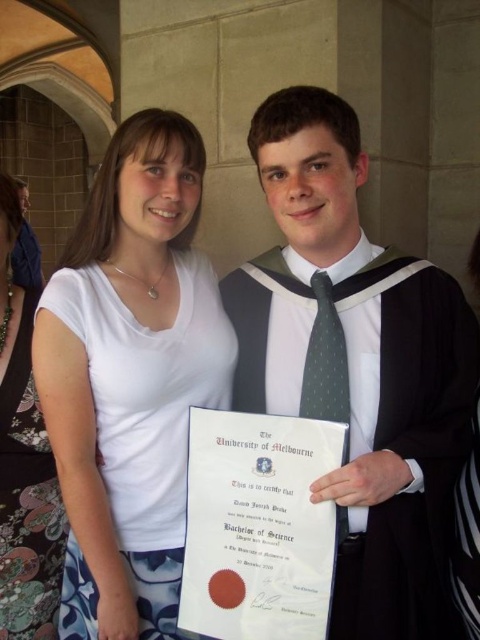
Looking at this image, does white fabric dress at center appear over green dotted fabric tie at center?

No, white fabric dress at center is not above green dotted fabric tie at center.

Between point (4, 592) and point (304, 378), which one is positioned behind?

Positioned behind is point (4, 592).

Who is more distant from viewer, (x=22, y=540) or (x=311, y=413)?

The point (x=22, y=540) is behind.

Locate an element on the screen. This screenshot has width=480, height=640. white fabric dress at center is located at coordinates (24, 460).

Which is above, matte black graduation gown at center or green dotted fabric tie at center?

matte black graduation gown at center is above.

Measure the distance between matte black graduation gown at center and green dotted fabric tie at center.

matte black graduation gown at center and green dotted fabric tie at center are 13.84 centimeters apart from each other.

Find the location of `matte black graduation gown at center`. matte black graduation gown at center is located at coordinates (358, 365).

Looking at this image, between matte black graduation gown at center and white fabric dress at center, which one appears on the right side from the viewer's perspective?

Positioned to the right is matte black graduation gown at center.

Does point (267, 372) lie behind point (22, 468)?

No.

Image resolution: width=480 pixels, height=640 pixels. I want to click on matte black graduation gown at center, so click(x=358, y=365).